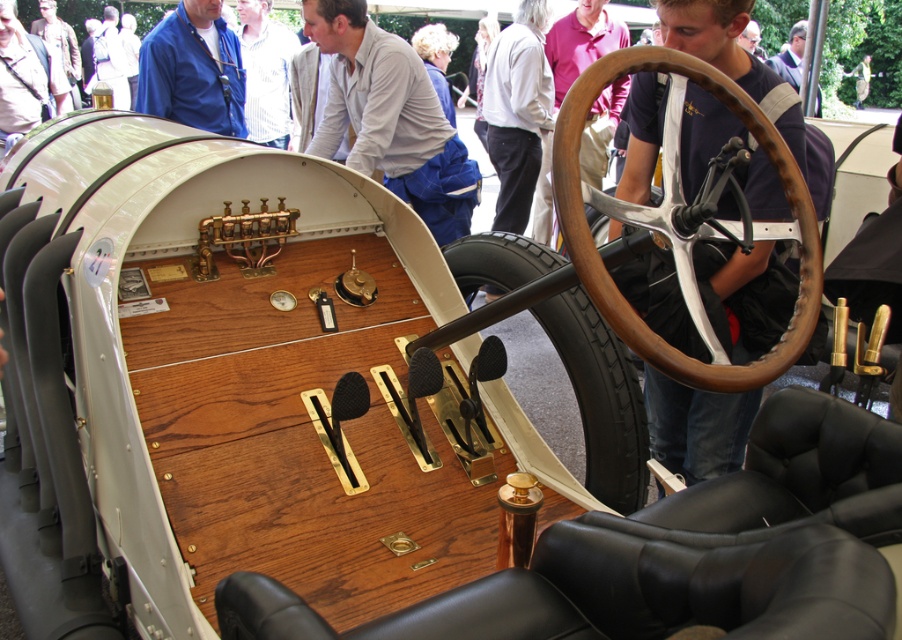
Question: Can you confirm if dark purple shirt at center is positioned to the right of light brown leather jacket at center?

Choices:
 (A) no
 (B) yes

Answer: (A)

Question: Based on their relative distances, which object is nearer to the wooden/leather steering wheel at center?

Choices:
 (A) dark purple shirt at center
 (B) light brown leather jacket at center
 (C) blue denim shirt at upper left

Answer: (C)

Question: Which point appears closest to the camera in this image?

Choices:
 (A) (670, 346)
 (B) (619, 108)
 (C) (183, 88)
 (D) (539, 61)

Answer: (A)

Question: Is blue denim shirt at upper left wider than dark purple shirt at center?

Choices:
 (A) no
 (B) yes

Answer: (A)

Question: Estimate the real-world distances between objects in this image. Which object is farther from the blue denim shirt at upper left?

Choices:
 (A) light brown leather jacket at center
 (B) dark blue shirt at upper center
 (C) black rubber tire at center
 (D) dark purple shirt at center

Answer: (B)

Question: Does white cotton shirt at upper center appear on the left side of striped cotton shirt at upper center?

Choices:
 (A) no
 (B) yes

Answer: (A)